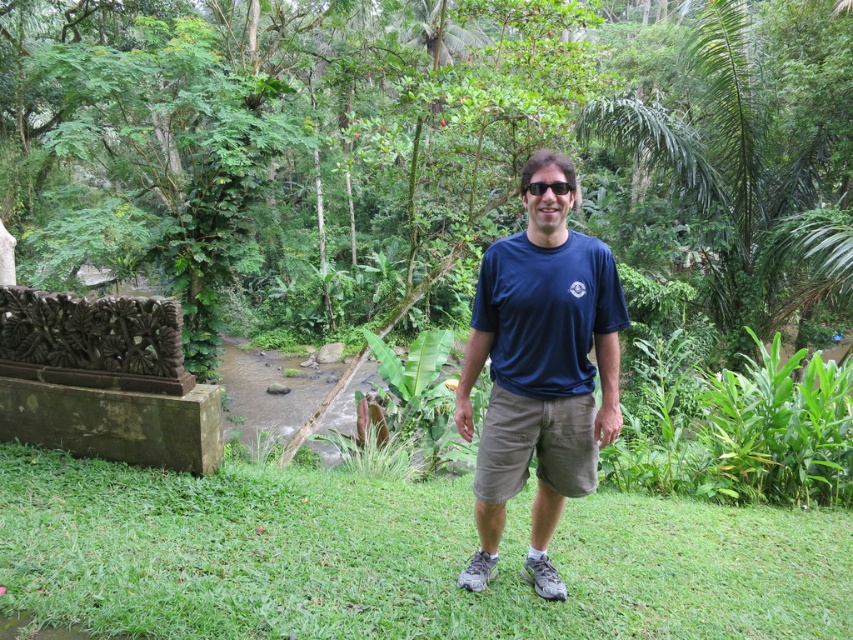
Question: Does green leafy tree at center appear over black plastic sunglasses at center?

Choices:
 (A) yes
 (B) no

Answer: (A)

Question: Can you confirm if brown wood fence at left is positioned below green grass at center?

Choices:
 (A) no
 (B) yes

Answer: (A)

Question: Can you confirm if green leafy tree at center is positioned to the right of navy blue t-shirt at center?

Choices:
 (A) yes
 (B) no

Answer: (A)

Question: Which object is positioned closest to the green grass at center?

Choices:
 (A) black plastic sunglasses at center
 (B) navy blue t-shirt at center

Answer: (B)

Question: Estimate the real-world distances between objects in this image. Which object is farther from the navy blue t-shirt at center?

Choices:
 (A) green leafy tree at center
 (B) green grass at center
 (C) brown wood fence at left
 (D) black plastic sunglasses at center

Answer: (C)

Question: Which object is closer to the camera taking this photo?

Choices:
 (A) black plastic sunglasses at center
 (B) brown wood fence at left
 (C) navy blue t-shirt at center

Answer: (A)